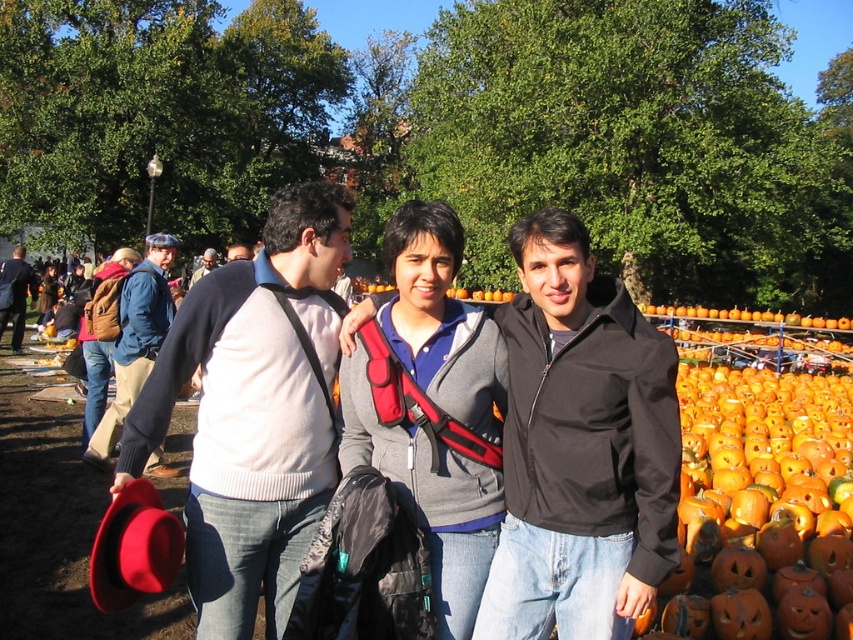
Question: Which point is closer to the camera taking this photo?

Choices:
 (A) (514, 524)
 (B) (244, 257)

Answer: (A)

Question: Which point is farther to the camera?

Choices:
 (A) (403, 298)
 (B) (131, 269)
 (C) (247, 250)
 (D) (32, 272)

Answer: (D)

Question: Which of these objects is positioned farthest from the matte brown backpack at center?

Choices:
 (A) denim jacket at left
 (B) knit sweater at center

Answer: (B)

Question: Does matte brown backpack at center appear on the left side of matte black sweater at center?

Choices:
 (A) no
 (B) yes

Answer: (A)

Question: Is the position of gray matte jacket at center more distant than that of matte brown backpack at center?

Choices:
 (A) no
 (B) yes

Answer: (A)

Question: Is knit sweater at center to the right of matte black sweater at center from the viewer's perspective?

Choices:
 (A) yes
 (B) no

Answer: (A)